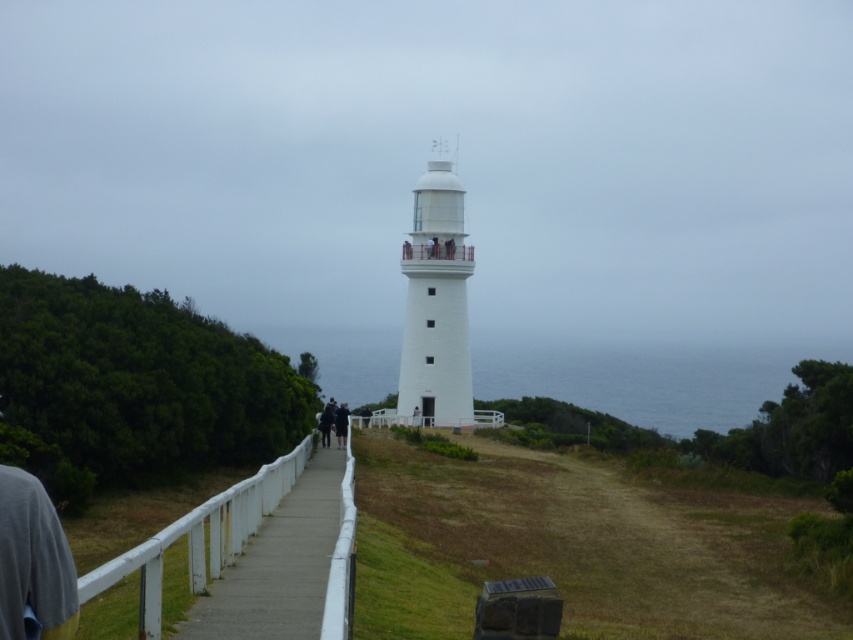
Question: Which object is farther from the camera taking this photo?

Choices:
 (A) white smooth tower at center
 (B) white wooden path at center

Answer: (A)

Question: Where is white wooden path at center located in relation to dark gray fabric jacket at center in the image?

Choices:
 (A) left
 (B) right

Answer: (B)

Question: Does white wooden path at center lie behind dark gray fabric jacket at center?

Choices:
 (A) yes
 (B) no

Answer: (B)

Question: Which object appears closest to the camera in this image?

Choices:
 (A) white smooth tower at center
 (B) white wooden path at center
 (C) dark gray fabric jacket at center

Answer: (B)

Question: Considering the real-world distances, which object is farthest from the dark gray fabric jacket at center?

Choices:
 (A) white smooth tower at center
 (B) white wooden path at center

Answer: (B)

Question: Is white smooth tower at center bigger than dark gray fabric jacket at center?

Choices:
 (A) no
 (B) yes

Answer: (A)